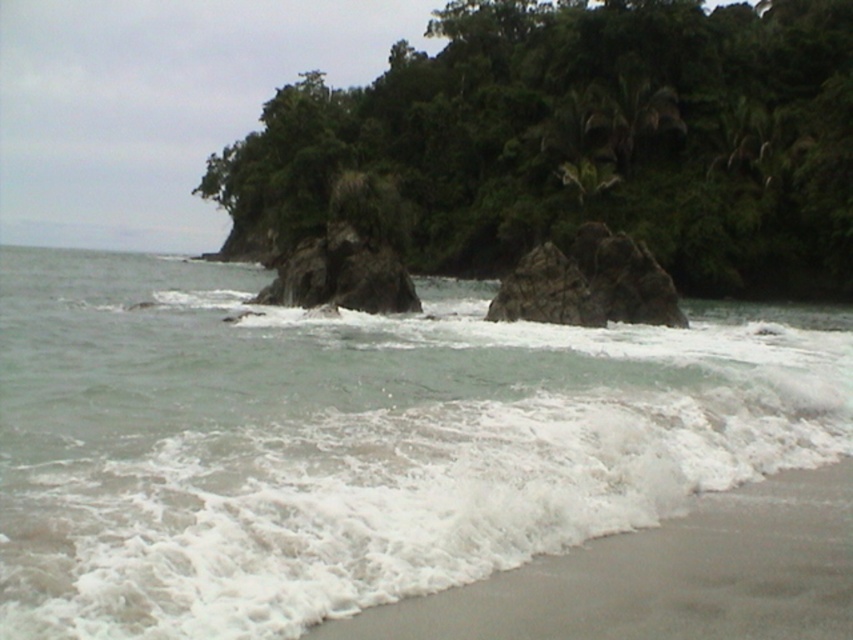
Does clear water at center have a lesser height compared to gray sand at lower right?

No, clear water at center is not shorter than gray sand at lower right.

Does clear water at center appear on the left side of gray sand at lower right?

Answer: Yes, clear water at center is to the left of gray sand at lower right.

Between point (152, 632) and point (776, 499), which one is positioned behind?

Positioned behind is point (776, 499).

In order to click on clear water at center in this screenshot , I will do `click(352, 440)`.